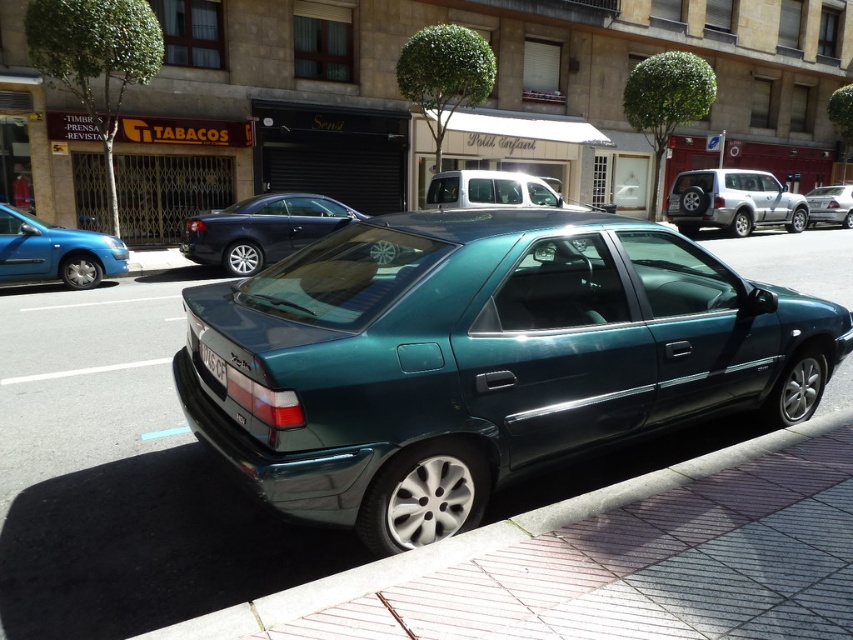
Question: Is satin silver suv at right below metallic blue sedan at left?

Choices:
 (A) no
 (B) yes

Answer: (A)

Question: Does metallic silver van at center appear on the right side of white plastic license plate at center?

Choices:
 (A) no
 (B) yes

Answer: (B)

Question: Which of the following is the closest to the observer?

Choices:
 (A) metallic blue sedan at left
 (B) teal metallic sedan at center
 (C) shiny black car at center

Answer: (A)

Question: Which of the following is the closest to the observer?

Choices:
 (A) metallic blue sedan at left
 (B) green tile pavement at lower right

Answer: (B)

Question: Is green tile pavement at lower right behind metallic silver van at center?

Choices:
 (A) no
 (B) yes

Answer: (A)

Question: Which point is farther from the camera taking this photo?

Choices:
 (A) (553, 509)
 (B) (260, 227)
 (C) (12, 552)

Answer: (B)